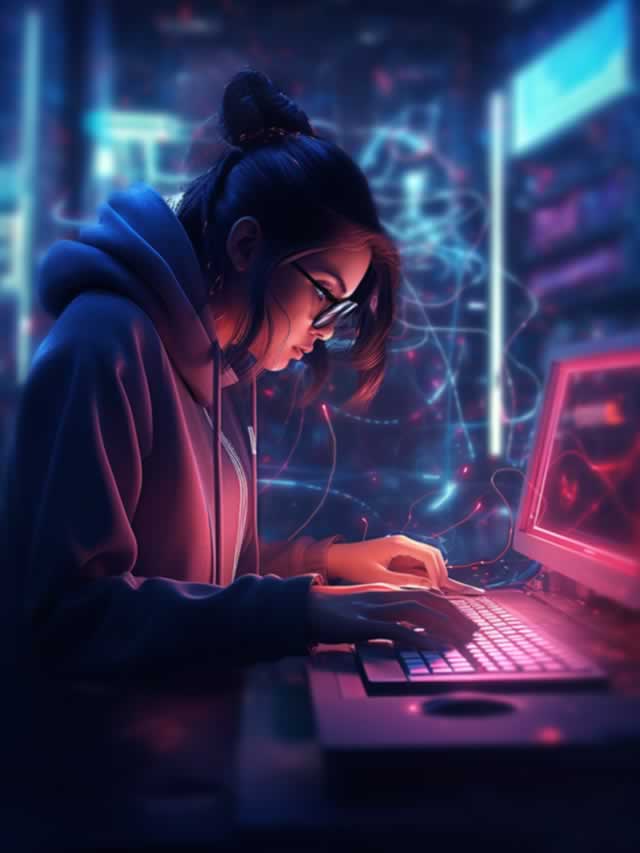
The width and height of the screenshot is (640, 853). Identify the location of computer keyboard. (500, 642).